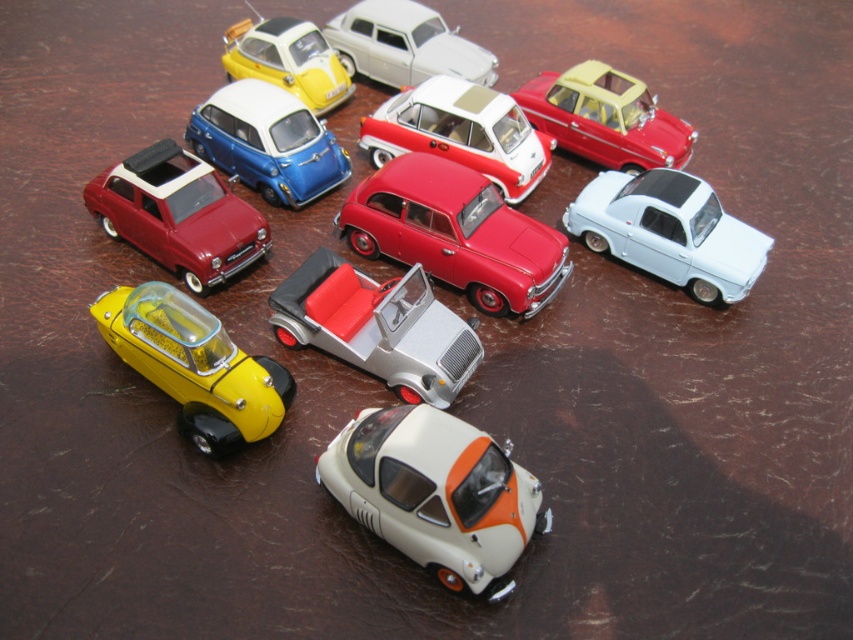
You are arranging miniature toy cars on a table. You have a matte red car at center and a matte blue car at upper center. From your viewpoint, which car is closer to you?

The matte red car at center is closer to you because the matte blue car at upper center is positioned behind it.

You are arranging miniature toy cars on a table. You have a white matte car at center and a shiny yellow car at bottom left. Which car is located to the right of the other?

The white matte car at center is positioned on the right side of the shiny yellow car at bottom left.